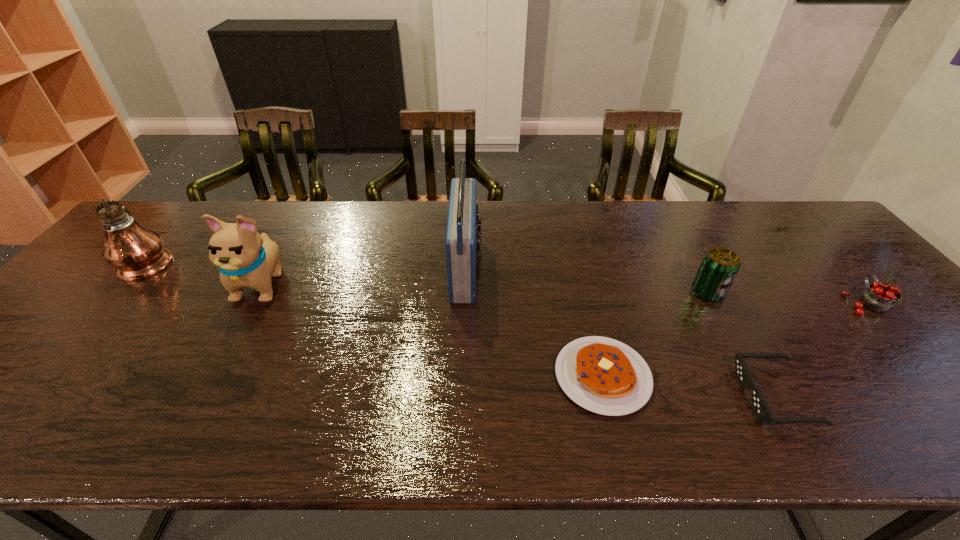
Locate an element on the screen. vacant region located on the front panel of the radio receiver is located at coordinates (574, 268).

Image resolution: width=960 pixels, height=540 pixels. Identify the location of free point located 0.150m on the face of the second object from left to right. (223, 358).

I want to click on free location located 0.190m on the right of the fourth shortest object, so click(795, 294).

The image size is (960, 540). Identify the location of vacant position located 0.250m on the handle side of the fifth tallest object. (802, 233).

Where is `vacant space located on the handle side of the fifth tallest object`? The width and height of the screenshot is (960, 540). vacant space located on the handle side of the fifth tallest object is located at coordinates (798, 230).

The image size is (960, 540). I want to click on vacant area located 0.260m on the handle side of the fifth tallest object, so click(800, 232).

This screenshot has width=960, height=540. Identify the location of free spot located 0.300m on the left of the pancake. (419, 376).

Locate an element on the screen. This screenshot has width=960, height=540. vacant area situated 0.350m on the front-facing side of the sunglasses is located at coordinates (581, 396).

This screenshot has width=960, height=540. Identify the location of vacant space located on the front-facing side of the sunglasses. (572, 396).

Locate an element on the screen. The width and height of the screenshot is (960, 540). free space located 0.120m on the front-facing side of the sunglasses is located at coordinates (689, 396).